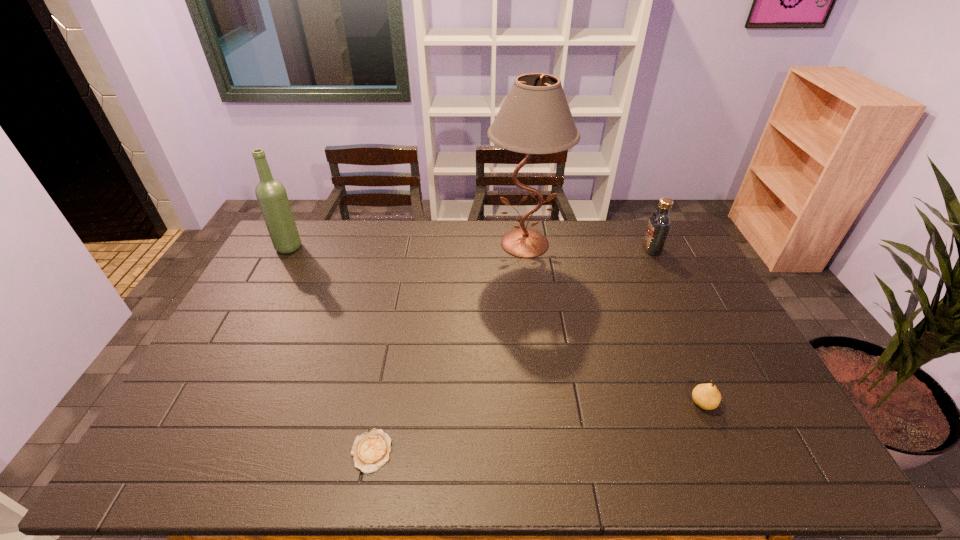
Identify the location of table lamp. The image size is (960, 540). (535, 118).

Find the location of a particular element. the tallest object is located at coordinates (535, 118).

Locate an element on the screen. wine bottle is located at coordinates (271, 194).

At what (x,y) coordinates should I click in order to perform the action: click on the leftmost object. Please return your answer as a coordinate pair (x, y). Image resolution: width=960 pixels, height=540 pixels. Looking at the image, I should click on (271, 194).

The image size is (960, 540). What are the coordinates of `vodka` in the screenshot? It's located at (659, 224).

Where is `the second shortest object`? This screenshot has height=540, width=960. the second shortest object is located at coordinates (706, 396).

Locate an element on the screen. pear is located at coordinates (706, 396).

Where is `the shortest object`? the shortest object is located at coordinates (370, 451).

Image resolution: width=960 pixels, height=540 pixels. In order to click on the nearest object in this screenshot , I will do `click(370, 451)`.

Locate an element on the screen. The width and height of the screenshot is (960, 540). free region located on the front-facing side of the table lamp is located at coordinates (534, 315).